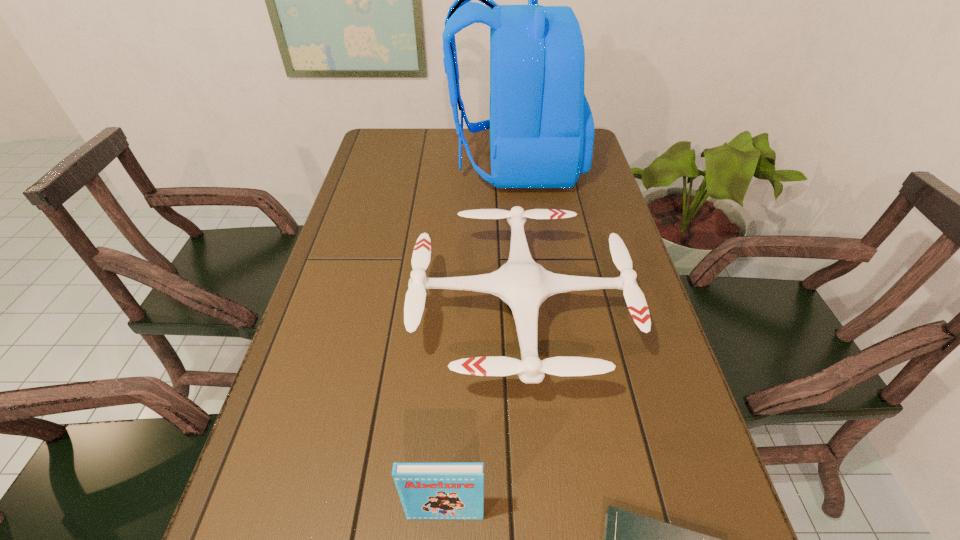
Locate an element on the screen. the farthest object is located at coordinates (541, 126).

Locate an element on the screen. backpack is located at coordinates [x=541, y=126].

This screenshot has width=960, height=540. I want to click on the second tallest object, so click(427, 490).

Where is `the taller book`? This screenshot has width=960, height=540. the taller book is located at coordinates (427, 490).

Locate an element on the screen. the third tallest object is located at coordinates (521, 283).

Locate an element on the screen. This screenshot has width=960, height=540. the second farthest object is located at coordinates (521, 283).

Image resolution: width=960 pixels, height=540 pixels. I want to click on vacant region located on the back of the tallest object, so click(x=380, y=165).

Where is `blank area located 0.160m on the back of the tallest object`? The height and width of the screenshot is (540, 960). blank area located 0.160m on the back of the tallest object is located at coordinates (404, 165).

At what (x,y) coordinates should I click in order to perform the action: click on vacant space located 0.140m on the back of the tallest object. Please return your answer as a coordinate pair (x, y). This screenshot has height=540, width=960. Looking at the image, I should click on (410, 165).

At what (x,y) coordinates should I click in order to perform the action: click on free spot located with the camera attached at the bottom of the drone. Please return your answer as a coordinate pair (x, y). This screenshot has height=540, width=960. Looking at the image, I should click on pos(367,312).